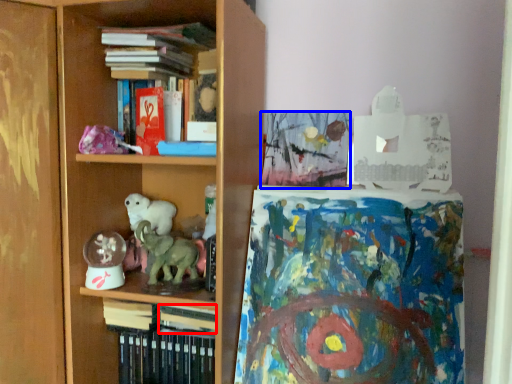
Question: Which of the following is the farthest to the observer, book (highlighted by a red box) or book (highlighted by a blue box)?

Choices:
 (A) book
 (B) book

Answer: (B)